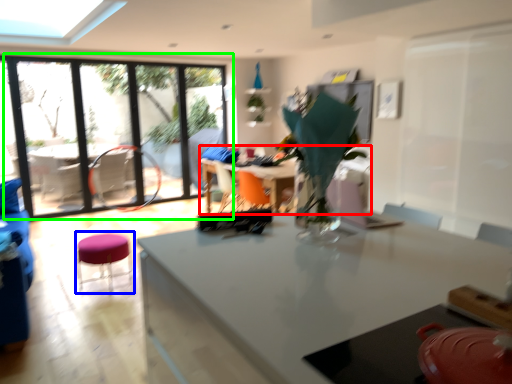
Question: Which is farther away from table (highlighted by a red box)? bar stool (highlighted by a blue box) or window (highlighted by a green box)?

Choices:
 (A) bar stool
 (B) window

Answer: (B)